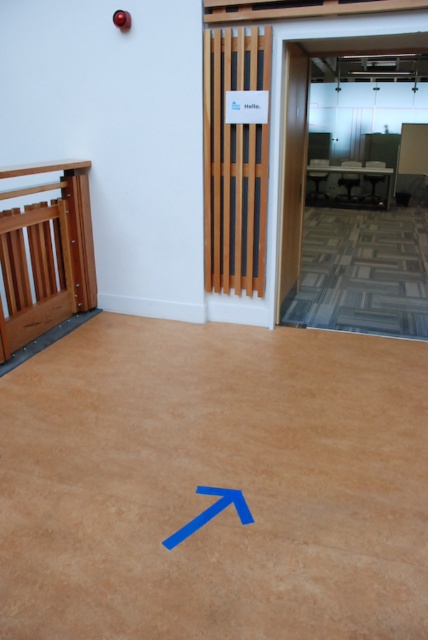
Question: Among these objects, which one is farthest from the camera?

Choices:
 (A) wooden gate at left
 (B) wooden elevator at center
 (C) blue matte arrow at upper center

Answer: (B)

Question: From the image, what is the correct spatial relationship of transparent glass elevator at upper center in relation to wooden elevator at center?

Choices:
 (A) left
 (B) right

Answer: (B)

Question: Does wooden gate at left have a larger size compared to blue matte arrow at upper center?

Choices:
 (A) yes
 (B) no

Answer: (A)

Question: Which of the following is the farthest from the observer?

Choices:
 (A) wooden elevator at center
 (B) wooden gate at left
 (C) transparent glass elevator at upper center
 (D) blue matte arrow at upper center

Answer: (C)

Question: Can you confirm if wooden elevator at center is positioned to the left of wooden gate at left?

Choices:
 (A) yes
 (B) no

Answer: (B)

Question: Which of these objects is positioned farthest from the blue matte arrow at upper center?

Choices:
 (A) transparent glass elevator at upper center
 (B) wooden gate at left
 (C) wooden elevator at center

Answer: (A)